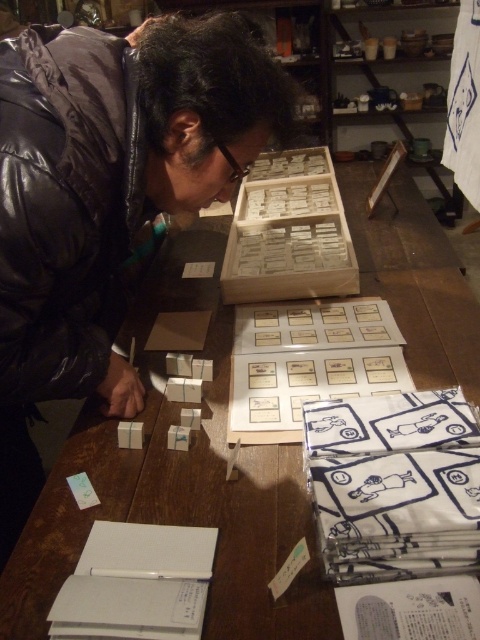
You are a visitor in the workshop and want to place a new item between the wooden box at upper center and the transparent plastic glasses at center. Can you do that?

The wooden box at upper center is to the right of the transparent plastic glasses at center, so there is space between them to place a new item.

You are an assistant in the workshop and need to locate the wooden box at upper center. According to the coordinates provided, where exactly is it positioned?

The wooden box at upper center is located at coordinates point (288, 232).

You are standing in the workshop and see the point at coordinates (107, 198). What object is this point located on?

The point at coordinates (107, 198) is located on the matte black jacket at center.